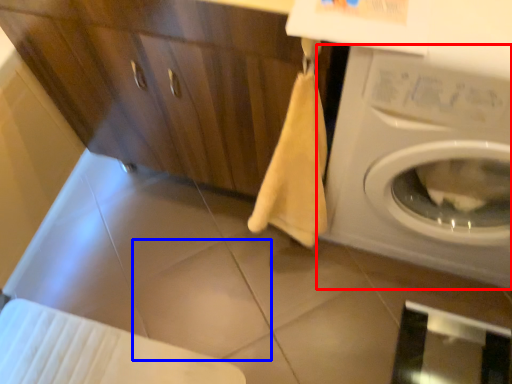
Question: Among these objects, which one is nearest to the camera, washing machine (highlighted by a red box) or tile (highlighted by a blue box)?

Choices:
 (A) washing machine
 (B) tile

Answer: (A)